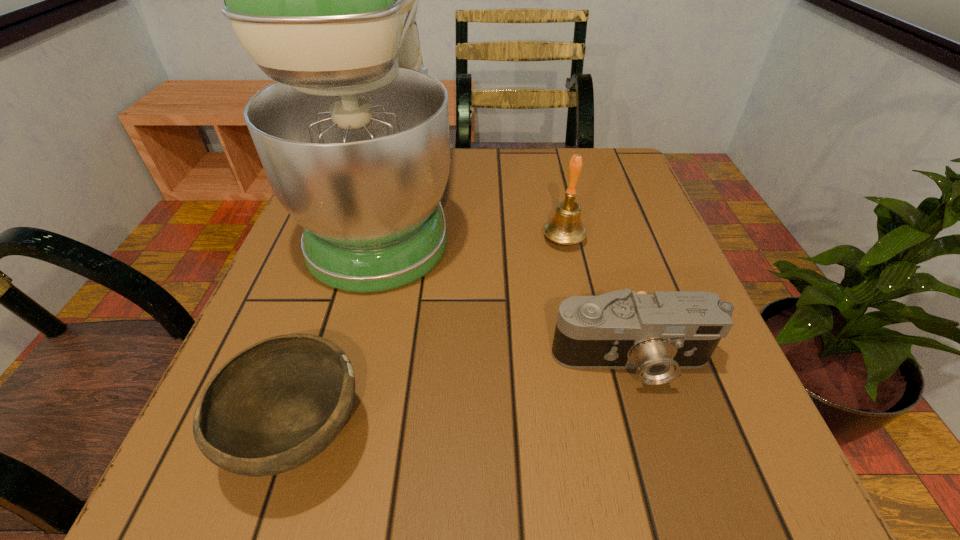
Where is `mixer that is at the left edge`? mixer that is at the left edge is located at coordinates (353, 136).

Find the location of `bowl at the left edge`. bowl at the left edge is located at coordinates (276, 405).

Where is `bell at the right edge`? bell at the right edge is located at coordinates (565, 227).

At what (x,y) coordinates should I click in order to perform the action: click on camera present at the right edge. Please return your answer as a coordinate pair (x, y). Image resolution: width=960 pixels, height=540 pixels. Looking at the image, I should click on (659, 334).

The image size is (960, 540). What are the coordinates of `object that is at the far left corner` in the screenshot? It's located at (353, 136).

At what (x,y) coordinates should I click in order to perform the action: click on object located in the near left corner section of the desktop. Please return your answer as a coordinate pair (x, y). The height and width of the screenshot is (540, 960). Looking at the image, I should click on (276, 405).

What are the coordinates of `vacant space at the far edge of the desktop` in the screenshot? It's located at (500, 158).

Identify the location of vacant area at the near edge of the desktop. (643, 461).

Identify the location of blank space at the right edge of the desktop. (684, 274).

In the image, there is a desktop. At what (x,y) coordinates should I click in order to perform the action: click on vacant space at the near right corner. Please return your answer as a coordinate pair (x, y). The width and height of the screenshot is (960, 540). Looking at the image, I should click on tap(774, 463).